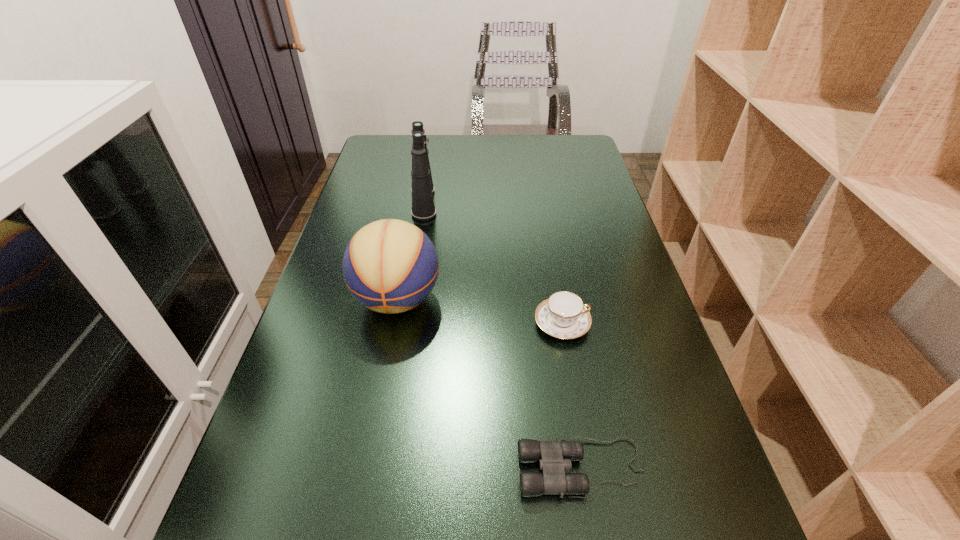
You are a GUI agent. You are given a task and a screenshot of the screen. Output one action in this format:
    pyautogui.click(x=<x>, y=<y>)
    Task: Click on the object that is the second nearest to the basketball
    
    Given the screenshot: What is the action you would take?
    pyautogui.click(x=563, y=315)

Locate which object ranks third in proximity to the basketball. Please provide its 2D coordinates. Your answer should be formatted as a tuple, i.e. [(x, y)], where the tuple contains the x and y coordinates of a point satisfying the conditions above.

[(554, 457)]